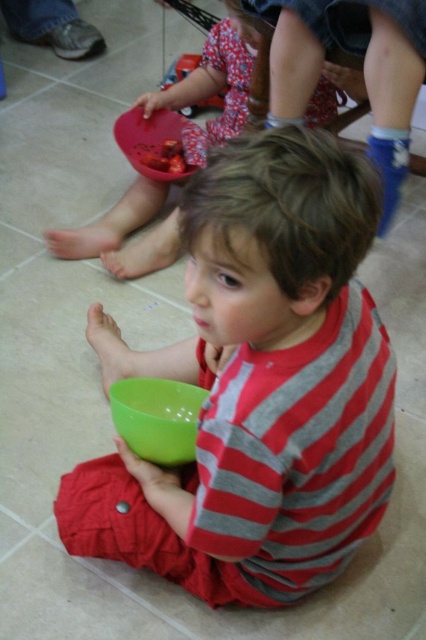
Which of these two, green plastic bowl at center or rubberized plastic bowl at upper center, stands shorter?

rubberized plastic bowl at upper center

Who is higher up, green plastic bowl at center or rubberized plastic bowl at upper center?

rubberized plastic bowl at upper center is higher up.

The height and width of the screenshot is (640, 426). I want to click on green plastic bowl at center, so click(x=258, y=385).

Does point (230, 36) come farther from viewer compared to point (157, 448)?

Yes, point (230, 36) is behind point (157, 448).

Who is shorter, matte plastic bowl at lower center or green plastic bowl at lower center?

With less height is green plastic bowl at lower center.

This screenshot has height=640, width=426. What do you see at coordinates (213, 83) in the screenshot?
I see `matte plastic bowl at lower center` at bounding box center [213, 83].

What are the coordinates of `matte plastic bowl at lower center` in the screenshot? It's located at (213, 83).

Can you confirm if green plastic bowl at center is positioned to the left of smooth red food at center?

In fact, green plastic bowl at center is to the right of smooth red food at center.

Which is more to the right, green plastic bowl at center or smooth red food at center?

Positioned to the right is green plastic bowl at center.

Does point (80, 531) come closer to viewer compared to point (170, 150)?

Yes, point (80, 531) is closer to viewer.

Find the location of a particular element. This screenshot has width=426, height=640. green plastic bowl at center is located at coordinates (258, 385).